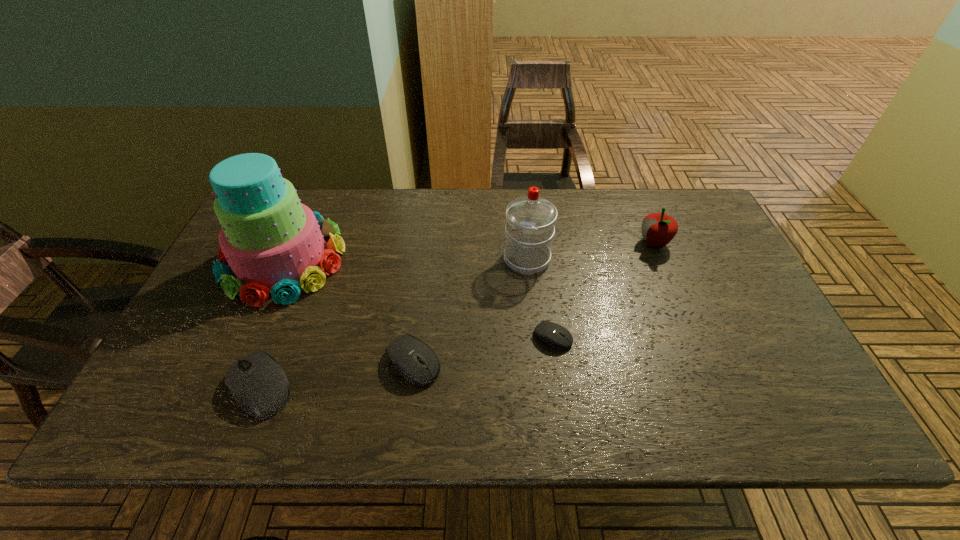
This screenshot has height=540, width=960. In order to click on the leftmost computer equipment in this screenshot , I will do (258, 384).

Locate an element on the screen. the fourth object from right to left is located at coordinates (403, 351).

This screenshot has height=540, width=960. What are the coordinates of `the second shortest object` in the screenshot? It's located at (403, 351).

The height and width of the screenshot is (540, 960). I want to click on the shortest object, so click(x=556, y=336).

The height and width of the screenshot is (540, 960). Find the location of `the shortest computer equipment`. the shortest computer equipment is located at coordinates (556, 336).

I want to click on the fifth shortest object, so click(530, 219).

Where is `cake`? Image resolution: width=960 pixels, height=540 pixels. cake is located at coordinates (273, 244).

Where is `the third tallest object`? the third tallest object is located at coordinates coord(658,229).

You are a GUI agent. You are given a task and a screenshot of the screen. Output one action in this format:
    pyautogui.click(x=<x>, y=<y>)
    Task: Click on the apple
    
    Given the screenshot: What is the action you would take?
    pyautogui.click(x=658, y=229)

In order to click on vacant space located on the right of the leftmost computer equipment in this screenshot , I will do `click(363, 388)`.